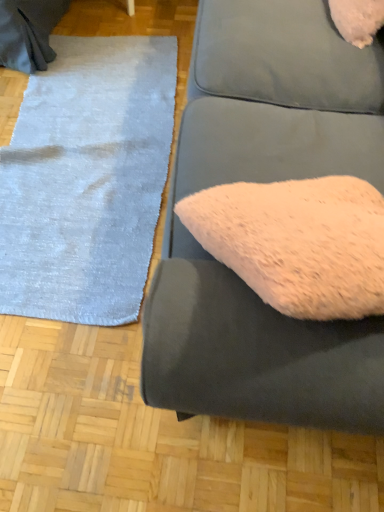
Question: In the image, is fuzzy fabric couch at center positioned in front of or behind light blue plush rug at left?

Choices:
 (A) front
 (B) behind

Answer: (A)

Question: Considering the positions of fuzzy fabric couch at center and light blue plush rug at left in the image, is fuzzy fabric couch at center wider or thinner than light blue plush rug at left?

Choices:
 (A) thin
 (B) wide

Answer: (A)

Question: From the image's perspective, is fuzzy fabric couch at center located above or below light blue plush rug at left?

Choices:
 (A) below
 (B) above

Answer: (A)

Question: Visually, is light blue plush rug at left positioned to the left or to the right of fuzzy fabric couch at center?

Choices:
 (A) right
 (B) left

Answer: (B)

Question: Considering the positions of light blue plush rug at left and fuzzy fabric couch at center in the image, is light blue plush rug at left bigger or smaller than fuzzy fabric couch at center?

Choices:
 (A) small
 (B) big

Answer: (A)

Question: From a real-world perspective, is light blue plush rug at left above or below fuzzy fabric couch at center?

Choices:
 (A) below
 (B) above

Answer: (A)

Question: Which is correct: light blue plush rug at left is inside fuzzy fabric couch at center, or outside of it?

Choices:
 (A) inside
 (B) outside

Answer: (B)